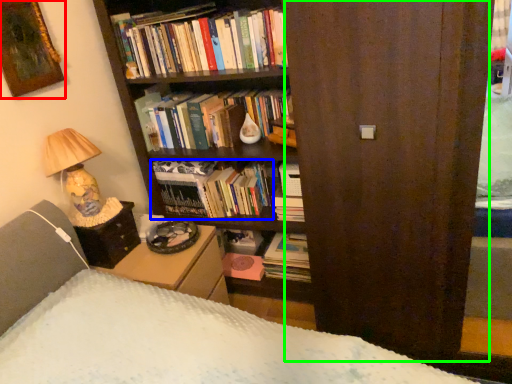
Question: Estimate the real-world distances between objects in this image. Which object is closer to picture frame (highlighted by a red box), book (highlighted by a blue box) or screen door (highlighted by a green box)?

Choices:
 (A) book
 (B) screen door

Answer: (A)